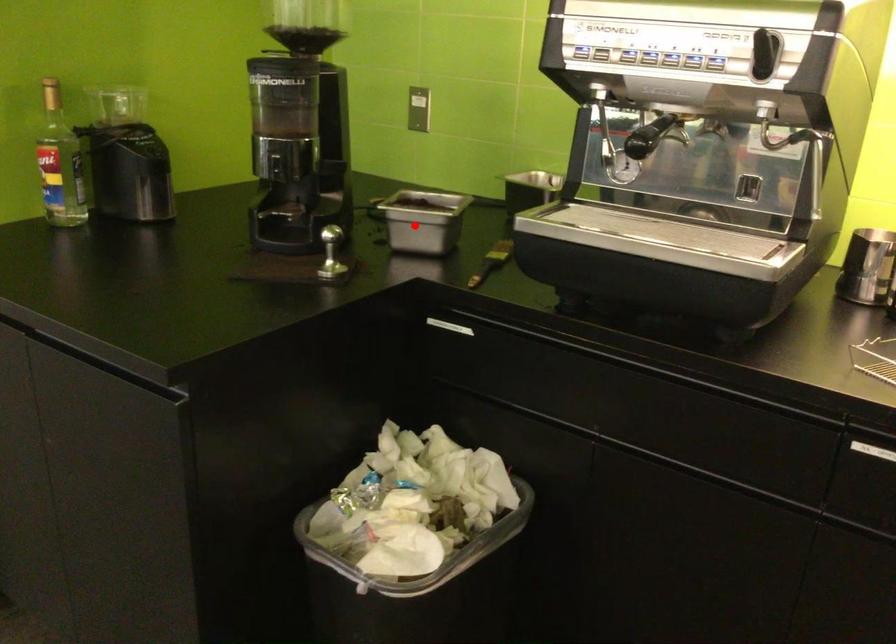
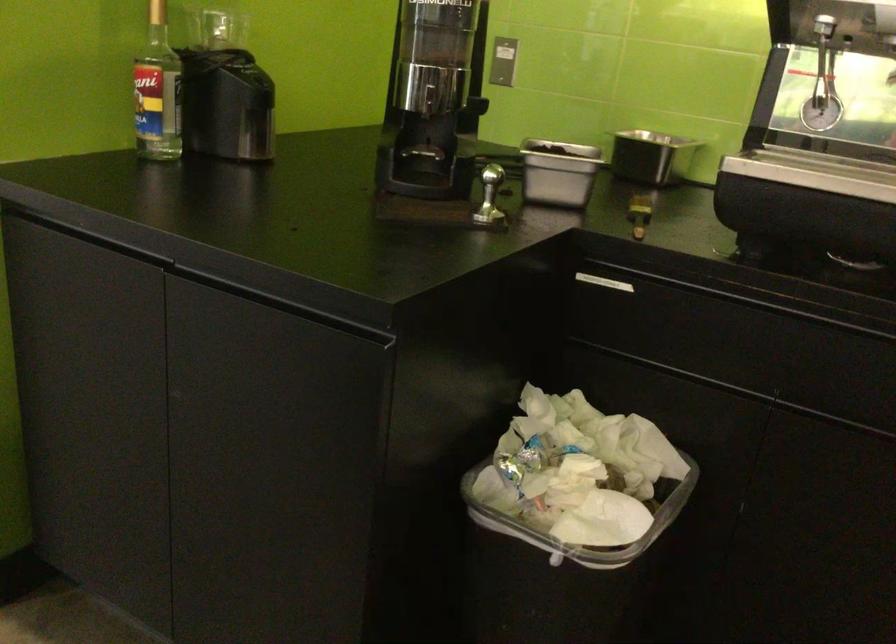
Question: I am providing you with two images of the same scene from different viewpoints. A red point is marked on the first image. At the location where the point appears in image 1, is it still visible in image 2?

Choices:
 (A) Yes
 (B) No

Answer: (A)